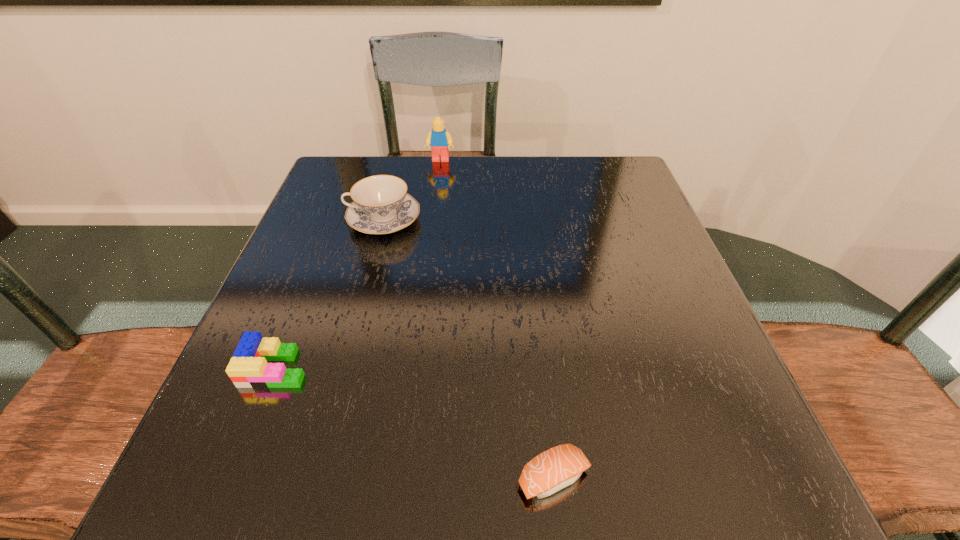
Locate an element on the screen. Image resolution: width=960 pixels, height=540 pixels. vacant space located on the back of the second nearest object is located at coordinates (295, 321).

Where is `vacant space located on the right of the nearest object`? The height and width of the screenshot is (540, 960). vacant space located on the right of the nearest object is located at coordinates (636, 478).

Locate an element on the screen. Lego located in the far edge section of the desktop is located at coordinates (439, 139).

Identify the location of chinaware situated at the far edge. pos(381,205).

Identify the location of object that is at the near edge. (549, 472).

Find the location of a particular element. chinaware located in the left edge section of the desktop is located at coordinates (381, 205).

Locate an element on the screen. Lego at the left edge is located at coordinates tap(248, 368).

You are a GUI agent. You are given a task and a screenshot of the screen. Output one action in this format:
    pyautogui.click(x=<x>, y=<y>)
    Task: Click on the object at the far left corner
    
    Given the screenshot: What is the action you would take?
    pyautogui.click(x=381, y=205)

At what (x,y) coordinates should I click in order to perform the action: click on vacant region at the far edge of the desktop. Please return your answer as a coordinate pair (x, y). The width and height of the screenshot is (960, 540). Looking at the image, I should click on (468, 199).

Find the location of a particular element. Image resolution: width=960 pixels, height=540 pixels. vacant space at the left edge is located at coordinates (347, 226).